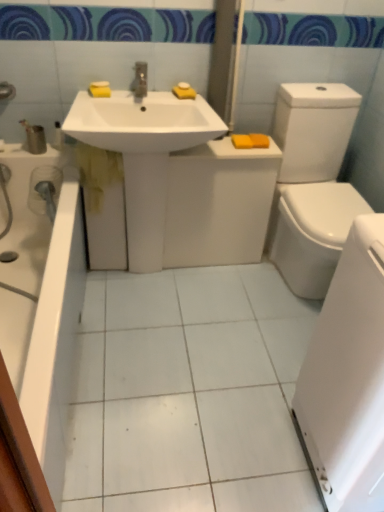
Question: Should I look upward or downward to see orange matte bar of soap at upper right, which is the 4th soap in left-to-right order?

Choices:
 (A) up
 (B) down

Answer: (A)

Question: From a real-world perspective, does yellow matte soap at right, marked as the first soap in a right-to-left arrangement, sit lower than yellow sponge at upper left, acting as the 1th soap starting from the left?

Choices:
 (A) yes
 (B) no

Answer: (A)

Question: Is yellow matte soap at right, marked as the first soap in a right-to-left arrangement, aimed at yellow sponge at upper left, the 5th soap in the right-to-left sequence?

Choices:
 (A) yes
 (B) no

Answer: (B)

Question: Is yellow sponge at upper left, the 5th soap in the right-to-left sequence, at the back of yellow matte soap at right, the fifth soap from the left?

Choices:
 (A) yes
 (B) no

Answer: (B)

Question: Is yellow sponge at upper left, the 5th soap in the right-to-left sequence, surrounded by yellow matte soap at right, marked as the first soap in a right-to-left arrangement?

Choices:
 (A) yes
 (B) no

Answer: (B)

Question: Does yellow matte soap at right, marked as the first soap in a right-to-left arrangement, have a larger size compared to yellow sponge at upper left, the 5th soap in the right-to-left sequence?

Choices:
 (A) no
 (B) yes

Answer: (B)

Question: Considering the relative sizes of yellow matte soap at right, the fifth soap from the left, and yellow sponge at upper left, acting as the 1th soap starting from the left, in the image provided, is yellow matte soap at right, the fifth soap from the left, smaller than yellow sponge at upper left, acting as the 1th soap starting from the left,?

Choices:
 (A) yes
 (B) no

Answer: (B)

Question: Is the depth of yellow sponge at upper center, arranged as the third soap when viewed from the left, less than that of yellow sponge at upper left, the 5th soap in the right-to-left sequence?

Choices:
 (A) no
 (B) yes

Answer: (A)

Question: Can you confirm if yellow sponge at upper center, arranged as the third soap when viewed from the left, is shorter than yellow sponge at upper left, the 5th soap in the right-to-left sequence?

Choices:
 (A) no
 (B) yes

Answer: (B)

Question: Considering the relative sizes of yellow sponge at upper center, arranged as the third soap when viewed from the left, and yellow sponge at upper left, acting as the 1th soap starting from the left, in the image provided, is yellow sponge at upper center, arranged as the third soap when viewed from the left, wider than yellow sponge at upper left, acting as the 1th soap starting from the left,?

Choices:
 (A) no
 (B) yes

Answer: (A)

Question: Does yellow sponge at upper center, arranged as the third soap when viewed from the left, have a larger size compared to yellow sponge at upper left, acting as the 1th soap starting from the left?

Choices:
 (A) yes
 (B) no

Answer: (B)

Question: Is yellow sponge at upper center, arranged as the third soap when viewed from the left, at the left side of yellow sponge at upper left, the 5th soap in the right-to-left sequence?

Choices:
 (A) no
 (B) yes

Answer: (A)

Question: From the image's perspective, is yellow sponge at upper center, arranged as the third soap when viewed from the left, on top of yellow sponge at upper left, the 5th soap in the right-to-left sequence?

Choices:
 (A) yes
 (B) no

Answer: (A)

Question: Is yellow sponge at upper center, which is the third soap from right to left, positioned before white glossy bathtub at lower left?

Choices:
 (A) no
 (B) yes

Answer: (A)